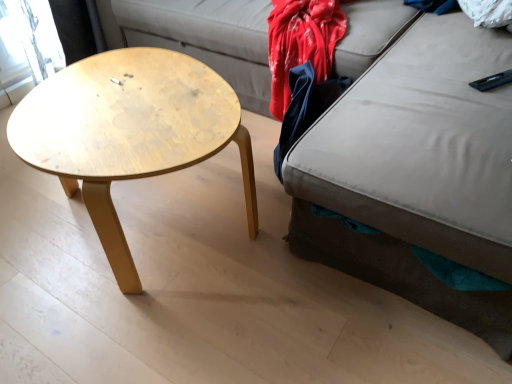
Where is `blank space situated above natural wood coffee table at left (from a real-world perspective)`? The image size is (512, 384). blank space situated above natural wood coffee table at left (from a real-world perspective) is located at coordinates (125, 105).